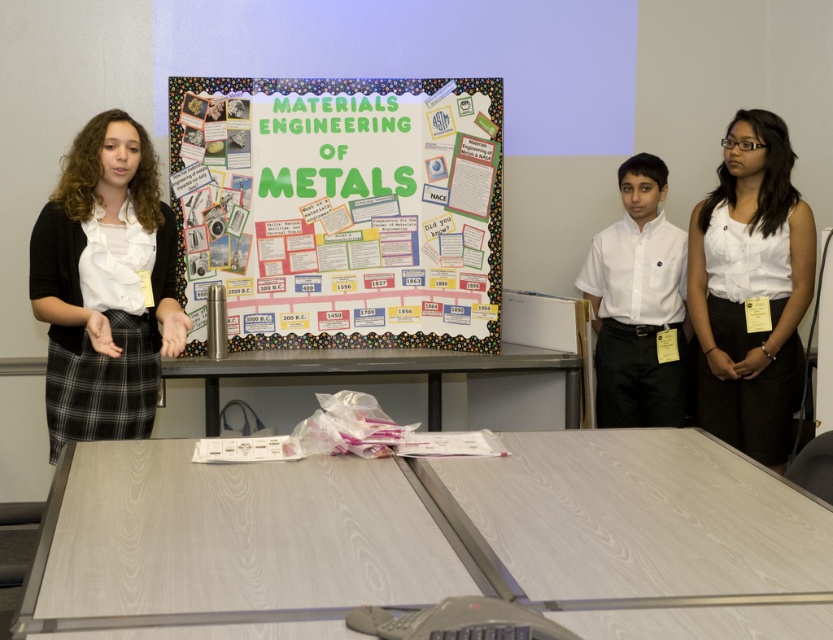
Question: Which point is closer to the camera taking this photo?

Choices:
 (A) (661, 179)
 (B) (252, 339)

Answer: (B)

Question: Which point is farther to the camera?

Choices:
 (A) metallic gray table at center
 (B) light wood table at center

Answer: (A)

Question: Where is multicolored paperboard at center located in relation to white smooth shirt at center in the image?

Choices:
 (A) left
 (B) right

Answer: (A)

Question: Which object appears farthest from the camera in this image?

Choices:
 (A) white satin blouse at center
 (B) light wood table at center

Answer: (A)

Question: Is multicolored paperboard at center positioned in front of white satin blouse at center?

Choices:
 (A) no
 (B) yes

Answer: (A)

Question: Can you confirm if white satin blouse at center is smaller than metallic gray table at center?

Choices:
 (A) yes
 (B) no

Answer: (A)